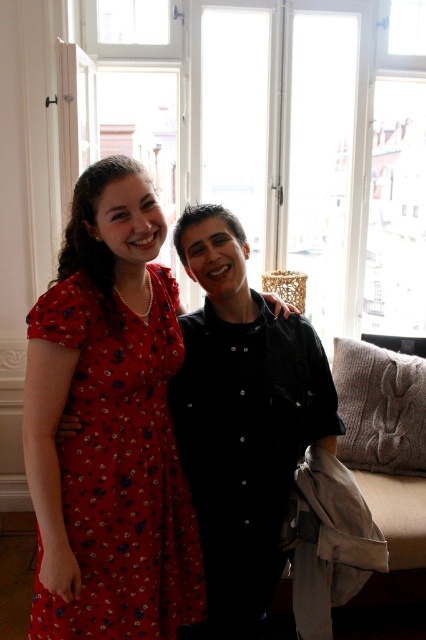
Question: Which point is closer to the camera?

Choices:
 (A) black button-up shirt at center
 (B) floral print fabric dress at left
 (C) transparent glass window at upper center

Answer: (B)

Question: Which point is farther to the camera?

Choices:
 (A) (328, 93)
 (B) (265, 378)

Answer: (A)

Question: Which of these objects is positioned farthest from the transparent glass window at upper center?

Choices:
 (A) floral print fabric dress at left
 (B) black button-up shirt at center

Answer: (A)

Question: Is transparent glass window at upper center closer to the viewer compared to black button-up shirt at center?

Choices:
 (A) yes
 (B) no

Answer: (B)

Question: Does transparent glass window at upper center appear on the right side of black button-up shirt at center?

Choices:
 (A) no
 (B) yes

Answer: (B)

Question: Does floral print fabric dress at left appear under black button-up shirt at center?

Choices:
 (A) no
 (B) yes

Answer: (B)